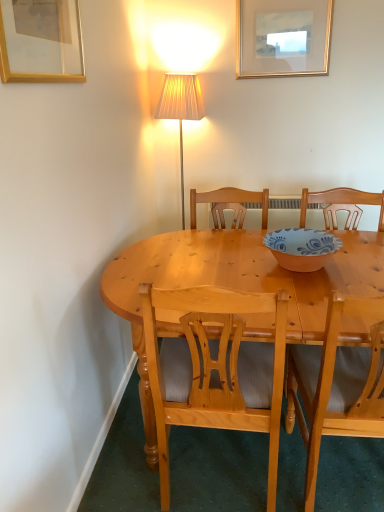
Where is `vacant area situated below light brown wooden chair at center, marked as the first chair in a left-to-right arrangement (from a real-world perspective)`? This screenshot has width=384, height=512. vacant area situated below light brown wooden chair at center, marked as the first chair in a left-to-right arrangement (from a real-world perspective) is located at coordinates pyautogui.click(x=226, y=483).